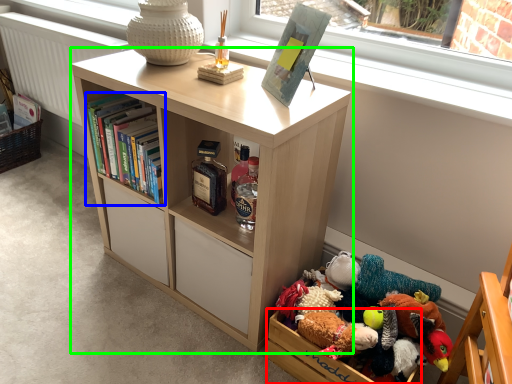
Question: Which object is positioned farthest from storage box (highlighted by a red box)? Select from book (highlighted by a blue box) and bookcase (highlighted by a green box).

Choices:
 (A) book
 (B) bookcase

Answer: (A)